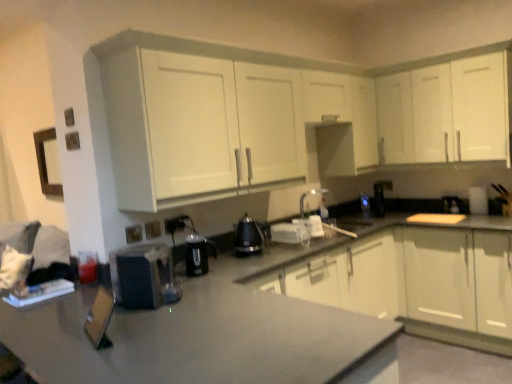
Question: Does white glossy cabinets at center, marked as the first cabinetry in a bottom-to-top arrangement, have a lesser width compared to black plastic kettle at center, arranged as the fourth appliance when viewed from the front?

Choices:
 (A) yes
 (B) no

Answer: (B)

Question: From the image's perspective, is white glossy cabinets at center, which is the 3th cabinetry from top to bottom, on top of black plastic kettle at center, which is counted as the 4th appliance, starting from the left?

Choices:
 (A) no
 (B) yes

Answer: (A)

Question: From the image's perspective, does white glossy cabinets at center, marked as the first cabinetry in a bottom-to-top arrangement, appear lower than black plastic kettle at center, arranged as the fourth appliance when viewed from the front?

Choices:
 (A) yes
 (B) no

Answer: (A)

Question: Is white glossy cabinets at center, which is the 3th cabinetry from top to bottom, turned away from black plastic kettle at center, arranged as the third appliance when viewed from the back?

Choices:
 (A) no
 (B) yes

Answer: (A)

Question: Is white glossy cabinets at center, marked as the first cabinetry in a bottom-to-top arrangement, in contact with black plastic kettle at center, arranged as the fourth appliance when viewed from the front?

Choices:
 (A) no
 (B) yes

Answer: (A)

Question: Can you confirm if white glossy cabinets at center, marked as the first cabinetry in a bottom-to-top arrangement, is positioned to the left of black plastic kettle at center, arranged as the third appliance when viewed from the back?

Choices:
 (A) no
 (B) yes

Answer: (A)

Question: Are matte plastic electric outlet at lower center, positioned as the second electric outlet in front-to-back order, and black plastic coffee maker at center, which is the 3th appliance from left to right, beside each other?

Choices:
 (A) no
 (B) yes

Answer: (A)

Question: Is matte plastic electric outlet at lower center, arranged as the 2th electric outlet when viewed from the right, wider than black plastic coffee maker at center, positioned as the fourth appliance in back-to-front order?

Choices:
 (A) no
 (B) yes

Answer: (A)

Question: Is matte plastic electric outlet at lower center, arranged as the 2th electric outlet when viewed from the right, bigger than black plastic coffee maker at center, positioned as the fourth appliance in back-to-front order?

Choices:
 (A) yes
 (B) no

Answer: (B)

Question: Considering the relative sizes of matte plastic electric outlet at lower center, arranged as the 2th electric outlet when viewed from the right, and black plastic coffee maker at center, arranged as the third appliance when viewed from the front, in the image provided, is matte plastic electric outlet at lower center, arranged as the 2th electric outlet when viewed from the right, taller than black plastic coffee maker at center, arranged as the third appliance when viewed from the front,?

Choices:
 (A) no
 (B) yes

Answer: (A)

Question: Is matte plastic electric outlet at lower center, arranged as the 2th electric outlet when viewed from the right, positioned with its back to black plastic coffee maker at center, which is the 3th appliance from left to right?

Choices:
 (A) no
 (B) yes

Answer: (A)

Question: Does matte plastic electric outlet at lower center, the second electric outlet in the left-to-right sequence, come in front of black plastic coffee maker at center, positioned as the fourth appliance in back-to-front order?

Choices:
 (A) yes
 (B) no

Answer: (B)

Question: Is white matte cabinet at upper center, positioned as the second cabinetry in top-to-bottom order, to the right of white glossy cabinet at upper right, arranged as the first cabinetry when viewed from the top, from the viewer's perspective?

Choices:
 (A) no
 (B) yes

Answer: (A)